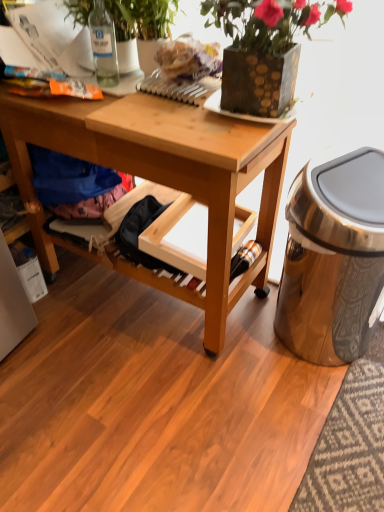
Where is `vacant area that lies in front of matte plastic bag at upper center`? Image resolution: width=384 pixels, height=512 pixels. vacant area that lies in front of matte plastic bag at upper center is located at coordinates (168, 108).